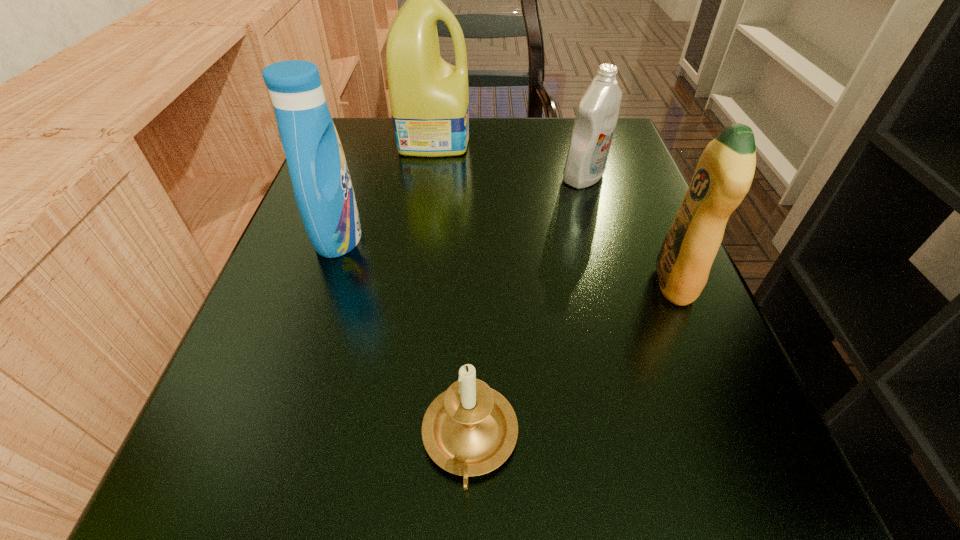
At what (x,y) coordinates should I click in order to perform the action: click on free space located 0.280m on the label of the rightmost detergent. Please return your answer as a coordinate pair (x, y). The height and width of the screenshot is (540, 960). Looking at the image, I should click on (463, 284).

Identify the location of vacant space positioned 0.340m on the label of the rightmost detergent. (421, 284).

Find the location of `free point located on the label of the rightmost detergent`. free point located on the label of the rightmost detergent is located at coordinates (552, 284).

At what (x,y) coordinates should I click in order to perform the action: click on free region located on the front of the fourth tallest object. Please return your answer as a coordinate pair (x, y). The image size is (960, 540). Looking at the image, I should click on (645, 388).

Where is `object that is at the near edge`? This screenshot has height=540, width=960. object that is at the near edge is located at coordinates (470, 429).

Locate an element on the screen. The image size is (960, 540). object located at the far left corner is located at coordinates (429, 98).

You are a GUI agent. You are given a task and a screenshot of the screen. Output one action in this format:
    pyautogui.click(x=<x>, y=<y>)
    Task: Click on the object that is positioned at the far right corner
    
    Given the screenshot: What is the action you would take?
    pyautogui.click(x=596, y=118)

Find the location of a particular element. vacant position at the far edge of the desktop is located at coordinates (536, 137).

This screenshot has width=960, height=540. I want to click on vacant space at the near edge of the desktop, so click(406, 482).

Find the location of a particular element. free region at the left edge of the desktop is located at coordinates (236, 407).